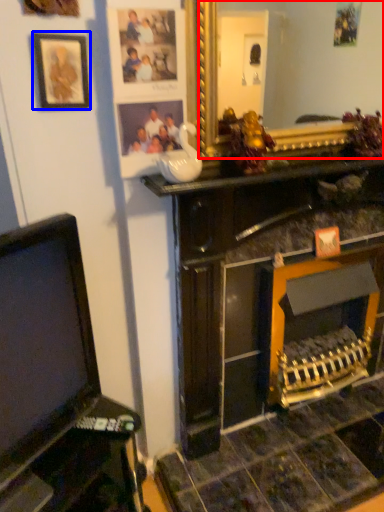
Question: Which of the following is the farthest to the observer, mirror (highlighted by a red box) or picture frame (highlighted by a blue box)?

Choices:
 (A) mirror
 (B) picture frame

Answer: (A)